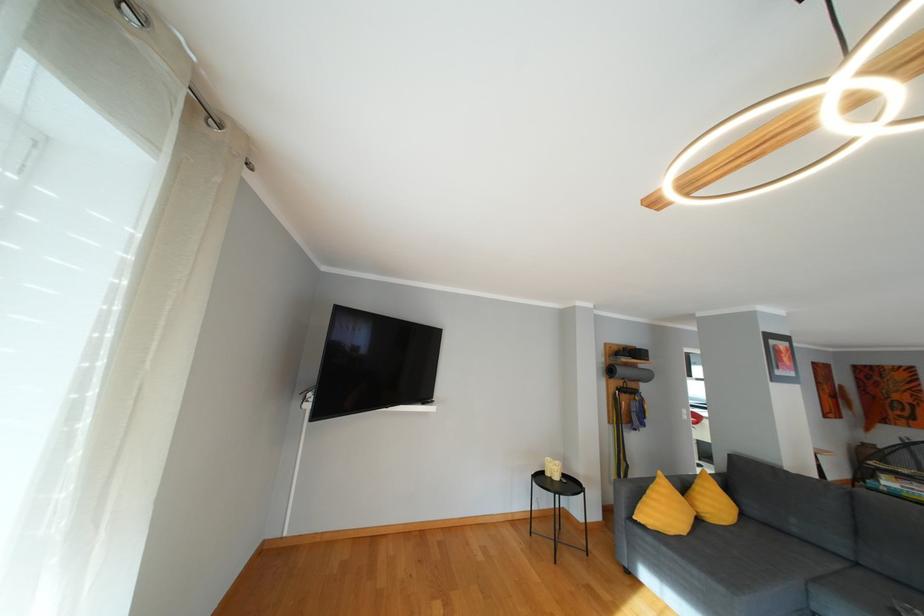
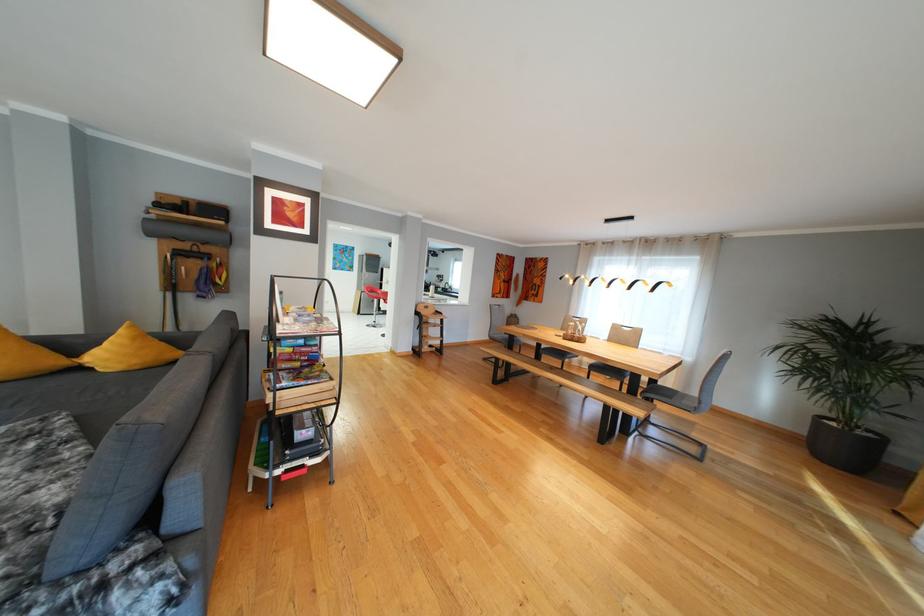
Question: What movement of the cameraman would produce the second image?

Choices:
 (A) Left
 (B) Right
 (C) Forward
 (D) Backward

Answer: (B)